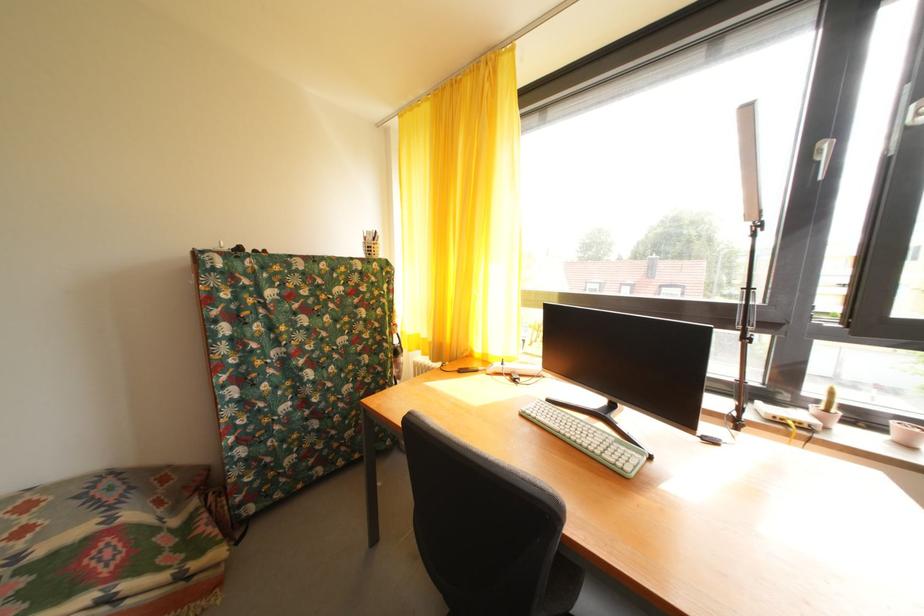
Where would you pull the yellow curtain? Please return your answer as a coordinate pair (x, y).

(462, 215)